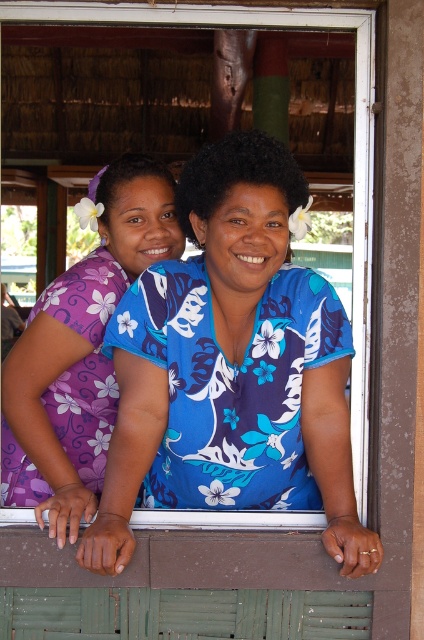
Question: Can you confirm if blue floral shirt at center is positioned above purple floral dress at left?

Choices:
 (A) yes
 (B) no

Answer: (B)

Question: Is the position of blue floral shirt at center more distant than that of purple floral dress at left?

Choices:
 (A) yes
 (B) no

Answer: (B)

Question: Which point appears farthest from the camera in this image?

Choices:
 (A) (192, 355)
 (B) (147, 209)

Answer: (B)

Question: Which of the following is the farthest from the observer?

Choices:
 (A) blue floral shirt at center
 (B) purple floral dress at left

Answer: (B)

Question: Is blue floral shirt at center smaller than purple floral dress at left?

Choices:
 (A) no
 (B) yes

Answer: (A)

Question: Which point is farther to the camera?

Choices:
 (A) (58, 445)
 (B) (328, 451)

Answer: (A)